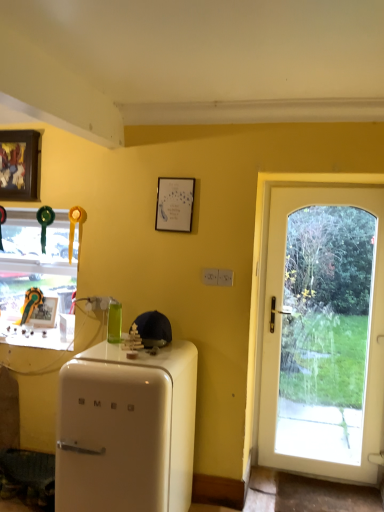
Question: In terms of height, does green glass bottle at center look taller or shorter compared to white glossy refrigerator at lower left?

Choices:
 (A) short
 (B) tall

Answer: (A)

Question: Considering the relative positions of green glass bottle at center and white glossy refrigerator at lower left in the image provided, is green glass bottle at center to the left or to the right of white glossy refrigerator at lower left?

Choices:
 (A) left
 (B) right

Answer: (A)

Question: Which object is the closest to the white glass door at right?

Choices:
 (A) white matte picture frame at upper center, arranged as the 2th picture frame when ordered from the bottom
 (B) matte black picture frame at left, which is counted as the 1th picture frame, starting from the bottom
 (C) wooden framed artwork at upper left, marked as the 2th picture frame in a front-to-back arrangement
 (D) white glossy refrigerator at lower left
 (E) clear glass window at left

Answer: (D)

Question: Which object is positioned farthest from the matte black picture frame at left, which is the third picture frame in front-to-back order?

Choices:
 (A) white glossy refrigerator at lower left
 (B) green glass bottle at center
 (C) clear glass window at left
 (D) wooden framed artwork at upper left, the 2th picture frame when ordered from right to left
 (E) white glass door at right

Answer: (E)